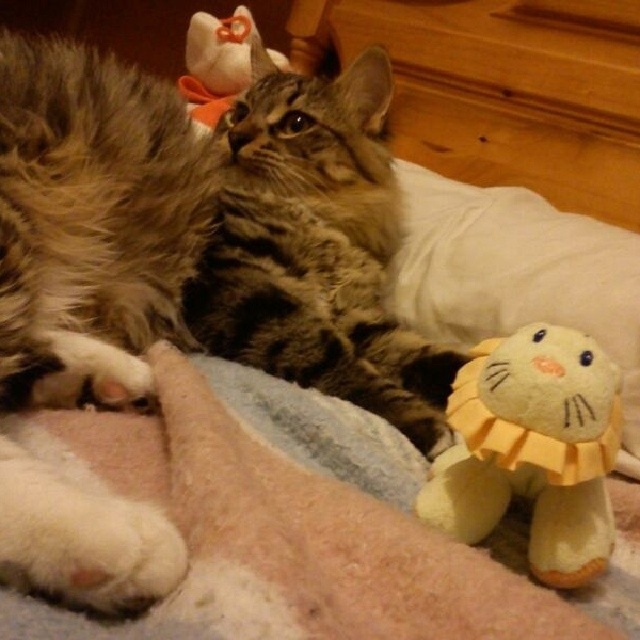
Who is lower down, fuzzy brown tabby cat at center or yellow plush toy at lower right?

yellow plush toy at lower right

Is point (300, 298) positioned after point (528, 406)?

Yes, point (300, 298) is farther from viewer.

Is point (339, 305) closer to viewer compared to point (548, 440)?

No, (339, 305) is behind (548, 440).

Locate an element on the screen. fuzzy brown tabby cat at center is located at coordinates (316, 248).

Is yellow fabric pillow at lower right positioned behind soft blue fabric at lower center?

Yes, yellow fabric pillow at lower right is behind soft blue fabric at lower center.

Is yellow fabric pillow at lower right bigger than soft blue fabric at lower center?

Indeed, yellow fabric pillow at lower right has a larger size compared to soft blue fabric at lower center.

Between point (536, 234) and point (262, 424), which one is positioned behind?

The point (536, 234) is behind.

Where is `yellow fabric pillow at lower right`? The image size is (640, 640). yellow fabric pillow at lower right is located at coordinates (516, 275).

This screenshot has height=640, width=640. What do you see at coordinates (202, 236) in the screenshot?
I see `fuzzy brown cat at center` at bounding box center [202, 236].

Which of these two, fuzzy brown cat at center or yellow fabric pillow at lower right, stands shorter?

With less height is yellow fabric pillow at lower right.

Is point (120, 140) farther from camera compared to point (426, 212)?

That is False.

At what (x,y) coordinates should I click in order to perform the action: click on fuzzy brown cat at center. Please return your answer as a coordinate pair (x, y). This screenshot has width=640, height=640. Looking at the image, I should click on (202, 236).